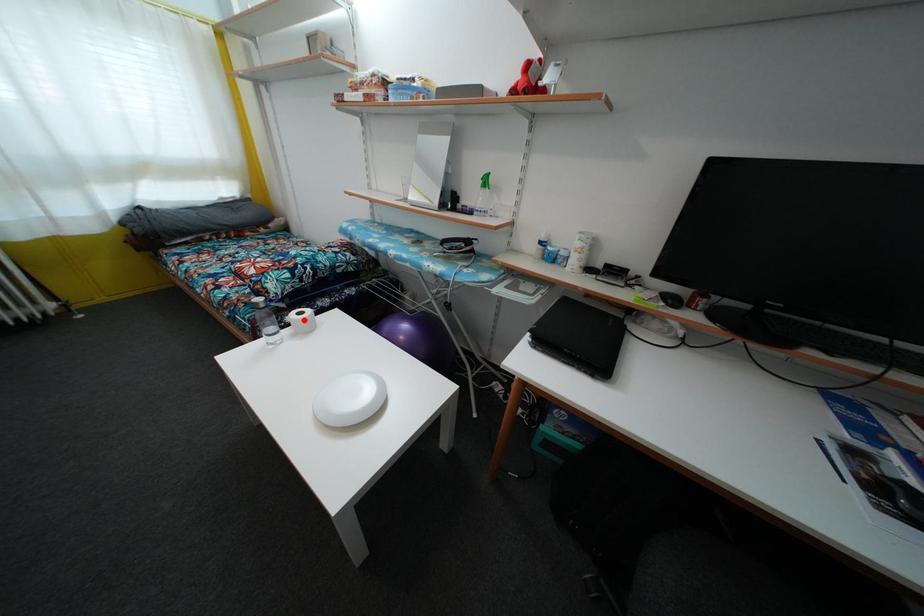
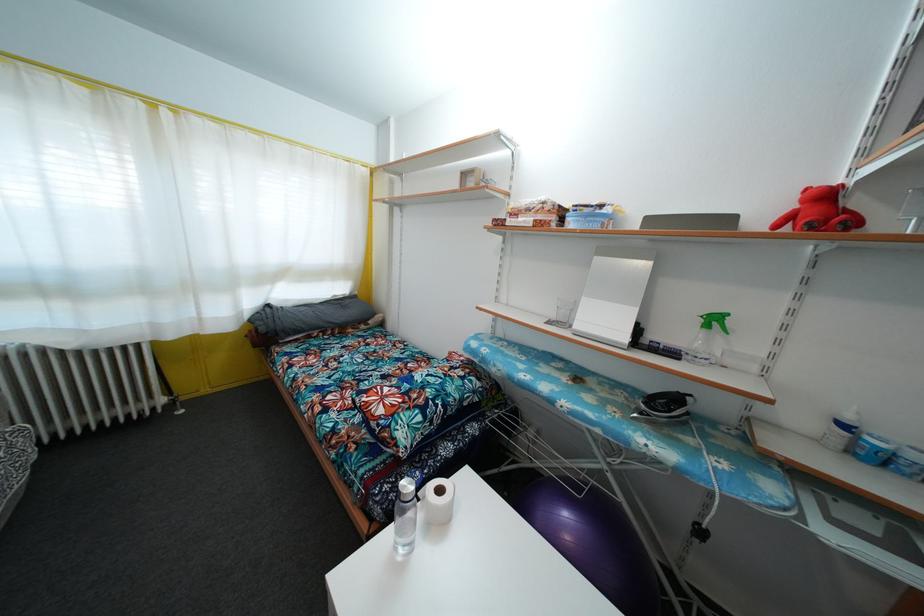
Locate, in the second image, the point that corresponds to the highlighted location in the first image.

(444, 498)